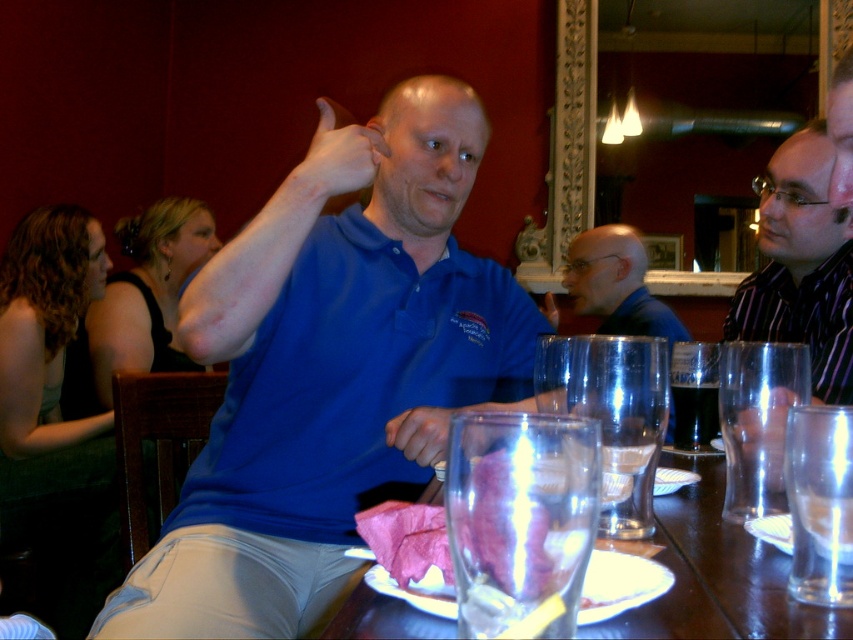
Question: Does transparent glass at center come in front of striped cotton shirt at right?

Choices:
 (A) yes
 (B) no

Answer: (A)

Question: Based on their relative distances, which object is nearer to the smooth pink meat at center?

Choices:
 (A) blue cotton shirt at center
 (B) striped cotton shirt at right
 (C) transparent glass at table right

Answer: (C)

Question: Is blue cotton shirt at center above transparent glass at table right?

Choices:
 (A) no
 (B) yes

Answer: (B)

Question: Which object is farther from the camera taking this photo?

Choices:
 (A) transparent glass at center
 (B) transparent glass at table right
 (C) clear glass water at center

Answer: (B)

Question: Does striped cotton shirt at right have a greater width compared to transparent glass at table right?

Choices:
 (A) yes
 (B) no

Answer: (A)

Question: Which object appears closest to the camera in this image?

Choices:
 (A) striped cotton shirt at right
 (B) transparent glass at table center

Answer: (B)